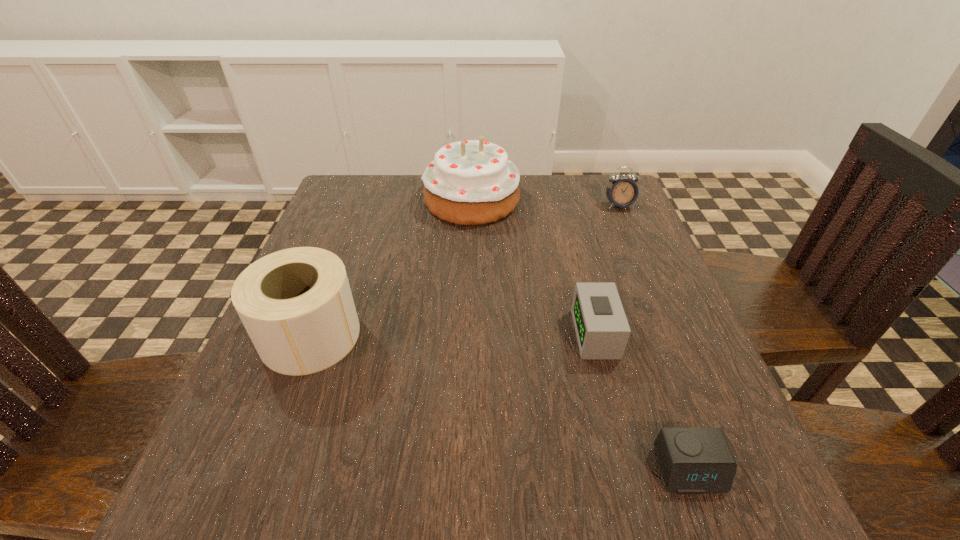
Find the location of a particular element. alarm clock that is the second closest to the shortest object is located at coordinates (623, 192).

Identify the location of vacant space that satisfies the following two spatial constraints: 1. on the face of the tallest alarm clock; 2. on the front-facing side of the fourth tallest object. (674, 334).